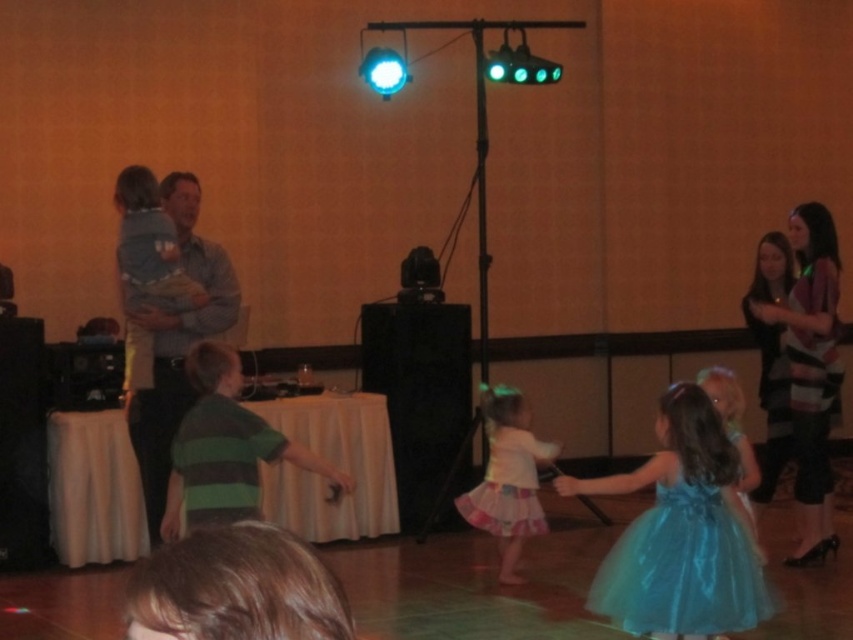
Question: Which point is farther to the camera?

Choices:
 (A) (625, 577)
 (B) (508, 417)
 (C) (126, 352)
 (D) (801, 262)

Answer: (D)

Question: Which of the following is the farthest from the observer?

Choices:
 (A) (170, 346)
 (B) (622, 600)

Answer: (A)

Question: Is striped sweater at right positioned behind white tulle skirt at center?

Choices:
 (A) yes
 (B) no

Answer: (B)

Question: Is shiny blue tulle dress at lower right to the left of striped sweater at right from the viewer's perspective?

Choices:
 (A) yes
 (B) no

Answer: (A)

Question: Which point appears closest to the camera in this image?

Choices:
 (A) (154, 333)
 (B) (808, 262)
 (C) (704, 545)
 (D) (157, 252)

Answer: (C)

Question: Observing the image, what is the correct spatial positioning of shiny blue tulle dress at lower right in reference to white tulle skirt at center?

Choices:
 (A) above
 (B) below

Answer: (B)